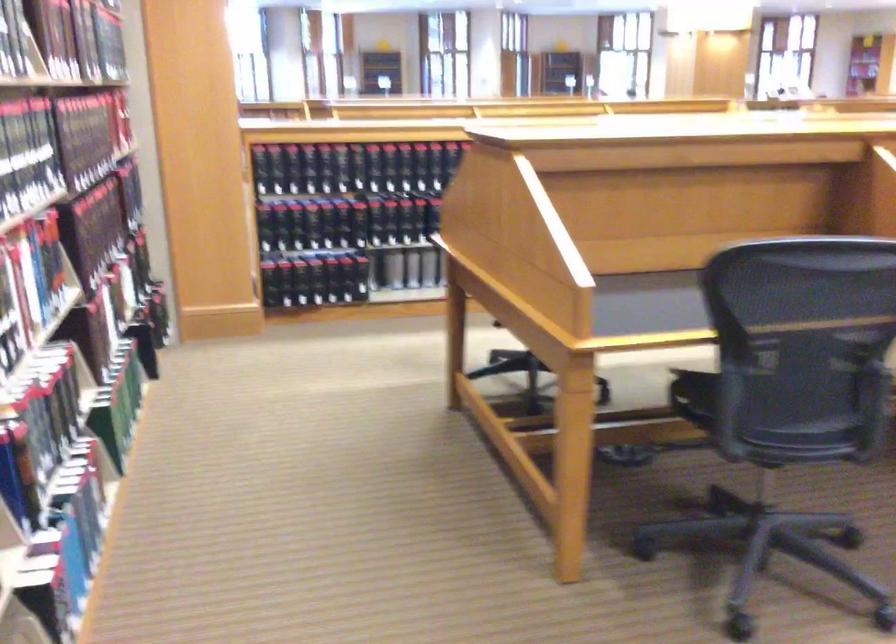
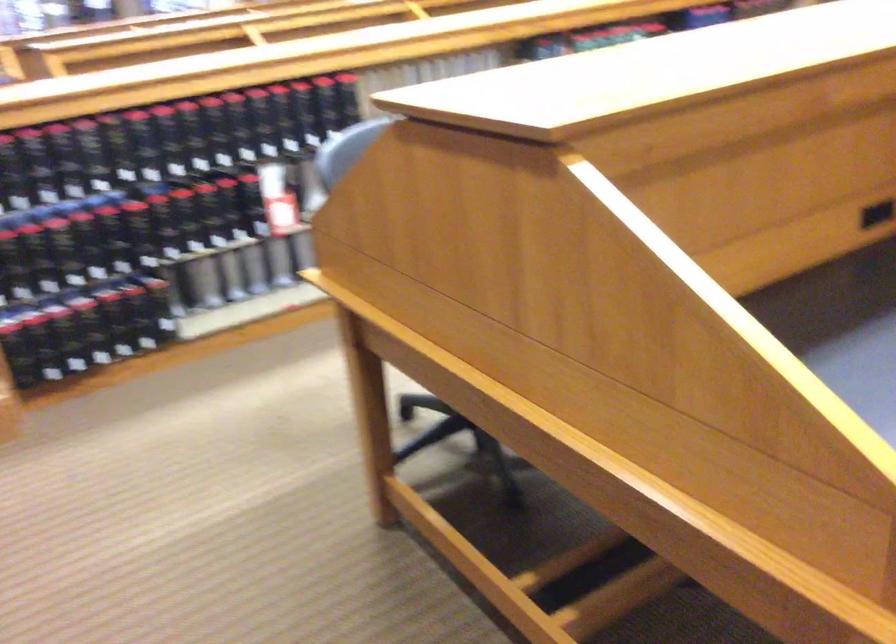
Find the pixel in the second image that matches the point at 307,274 in the first image.

(87, 328)